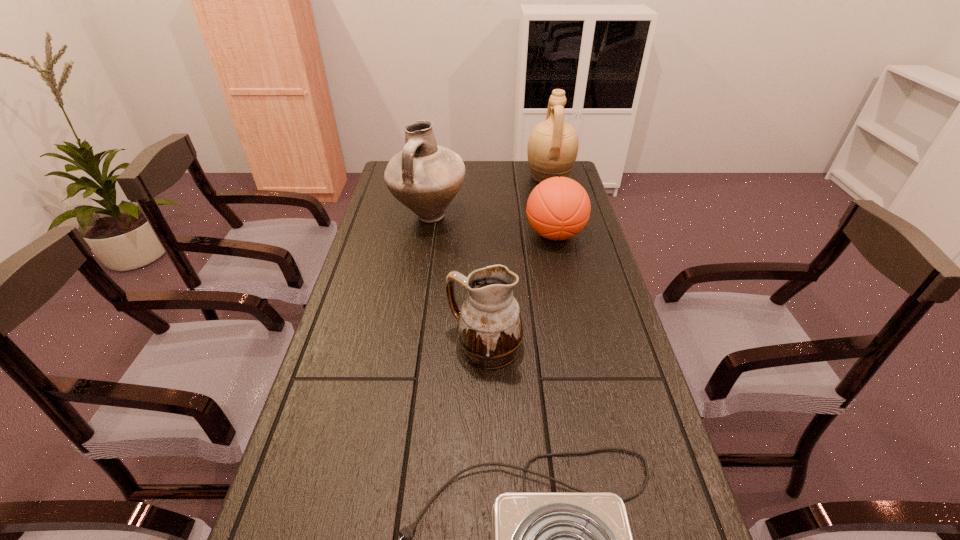
Identify the location of vacant area that satisfies the following two spatial constraints: 1. on the handle side of the second shortest object; 2. on the right side of the second nearest pitcher. (425, 234).